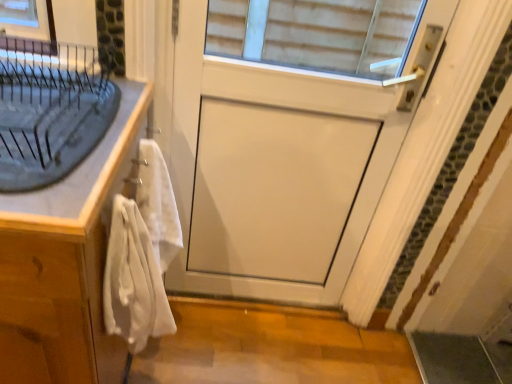
Question: Could white soft towel at left, the second bath towel positioned from the front, be considered to be inside white cotton bath towel at left, marked as the first bath towel in a front-to-back arrangement?

Choices:
 (A) yes
 (B) no

Answer: (B)

Question: Does white cotton bath towel at left, arranged as the second bath towel when viewed from the back, come behind white soft towel at left, which ranks as the 1th bath towel in back-to-front order?

Choices:
 (A) no
 (B) yes

Answer: (A)

Question: Does white cotton bath towel at left, arranged as the second bath towel when viewed from the back, have a larger size compared to white soft towel at left, the second bath towel positioned from the front?

Choices:
 (A) yes
 (B) no

Answer: (A)

Question: Can you confirm if white cotton bath towel at left, arranged as the second bath towel when viewed from the back, is positioned to the right of white soft towel at left, which ranks as the 1th bath towel in back-to-front order?

Choices:
 (A) yes
 (B) no

Answer: (A)

Question: From a real-world perspective, is white cotton bath towel at left, arranged as the second bath towel when viewed from the back, located beneath white soft towel at left, which ranks as the 1th bath towel in back-to-front order?

Choices:
 (A) yes
 (B) no

Answer: (A)

Question: Does white cotton bath towel at left, marked as the first bath towel in a front-to-back arrangement, have a greater width compared to white soft towel at left, which ranks as the 1th bath towel in back-to-front order?

Choices:
 (A) yes
 (B) no

Answer: (A)

Question: Are white matte door at center and white cotton bath towel at left, marked as the first bath towel in a front-to-back arrangement, far apart?

Choices:
 (A) no
 (B) yes

Answer: (A)

Question: Considering the relative sizes of white matte door at center and white cotton bath towel at left, arranged as the second bath towel when viewed from the back, in the image provided, is white matte door at center wider than white cotton bath towel at left, arranged as the second bath towel when viewed from the back,?

Choices:
 (A) no
 (B) yes

Answer: (A)

Question: Could you tell me if white matte door at center is facing white cotton bath towel at left, marked as the first bath towel in a front-to-back arrangement?

Choices:
 (A) yes
 (B) no

Answer: (A)

Question: Is the position of white matte door at center more distant than that of white cotton bath towel at left, marked as the first bath towel in a front-to-back arrangement?

Choices:
 (A) yes
 (B) no

Answer: (A)

Question: Is white matte door at center completely or partially outside of white cotton bath towel at left, arranged as the second bath towel when viewed from the back?

Choices:
 (A) no
 (B) yes

Answer: (B)

Question: Does white matte door at center have a greater height compared to white cotton bath towel at left, marked as the first bath towel in a front-to-back arrangement?

Choices:
 (A) yes
 (B) no

Answer: (A)

Question: Is white soft towel at left, which ranks as the 1th bath towel in back-to-front order, far away from white wood cabinet at left?

Choices:
 (A) no
 (B) yes

Answer: (A)